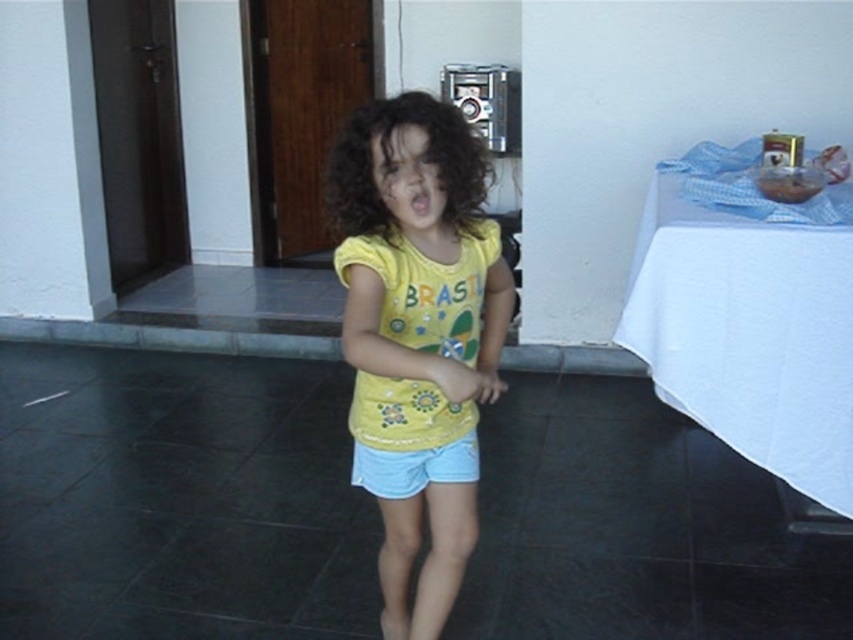
You are standing on the patio where the child is dancing. You need to place a small gift on the white cloth at right. Based on the coordinates provided, where exactly should you place it?

The white cloth at right is located at coordinates point (750, 324), so place the gift there.

You are a photographer setting up for a family photo. You need to position the child so that the white cloth at right and the light blue denim shorts at center are visible in the frame. Given their current distance, can you fit both in the shot without moving either object?

The white cloth at right and light blue denim shorts at center are 38.69 inches apart. Since the distance between them is manageable for a standard camera lens, you can capture both in the frame without needing to adjust their positions.

You are standing in the same position as the child and want to reach both the point at (711, 356) and the point at (346, 140). Which point is closer to you?

Point (346, 140) is closer to you because it is less further than point (711, 356).